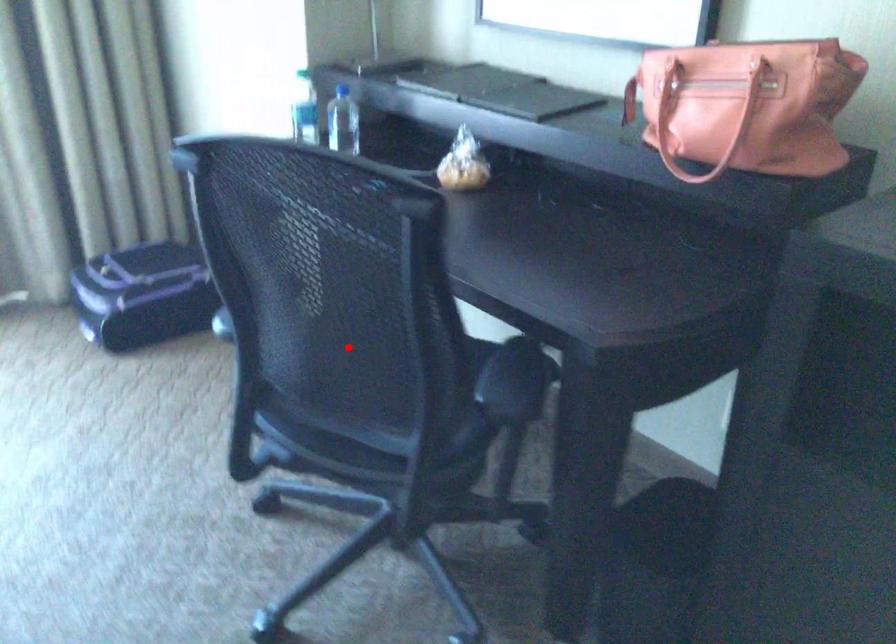
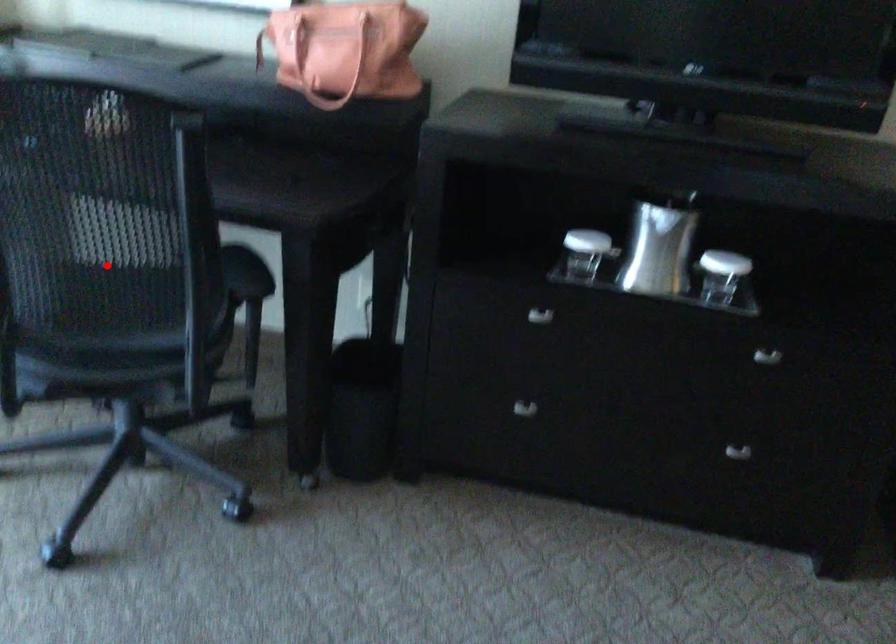
I am providing you with two images of the same scene from different viewpoints. A red point is marked on the first image and another point is marked on the second image. Is the marked point in image1 the same physical position as the marked point in image2?

Yes